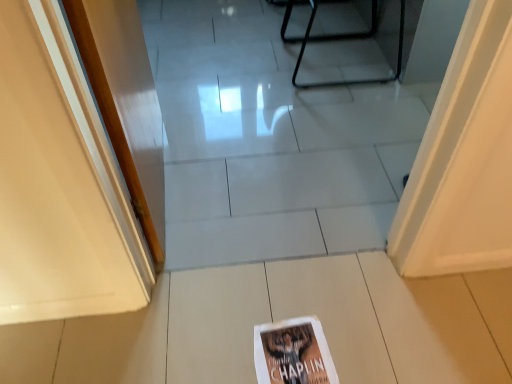
Where is `spots to the right of white paper book at center`? The width and height of the screenshot is (512, 384). spots to the right of white paper book at center is located at coordinates (372, 342).